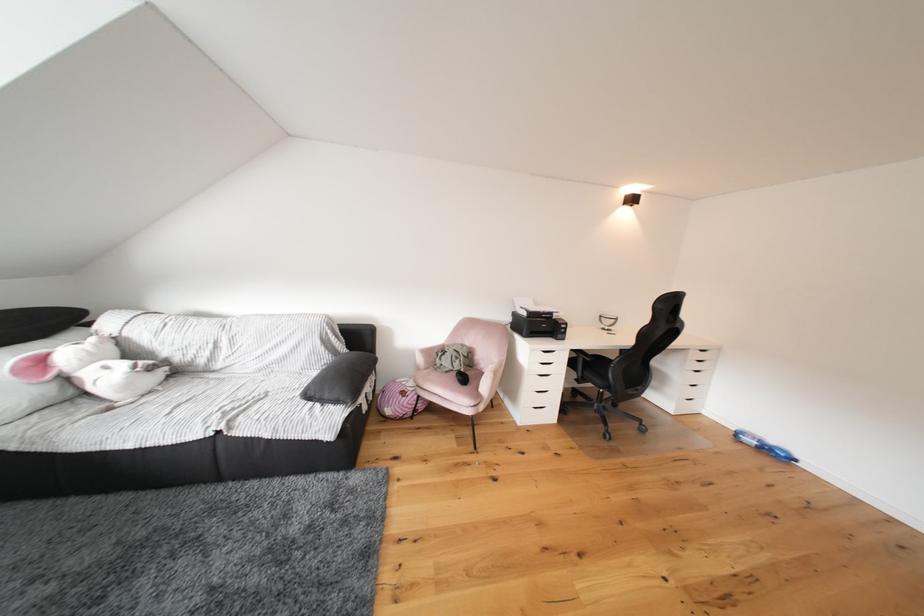
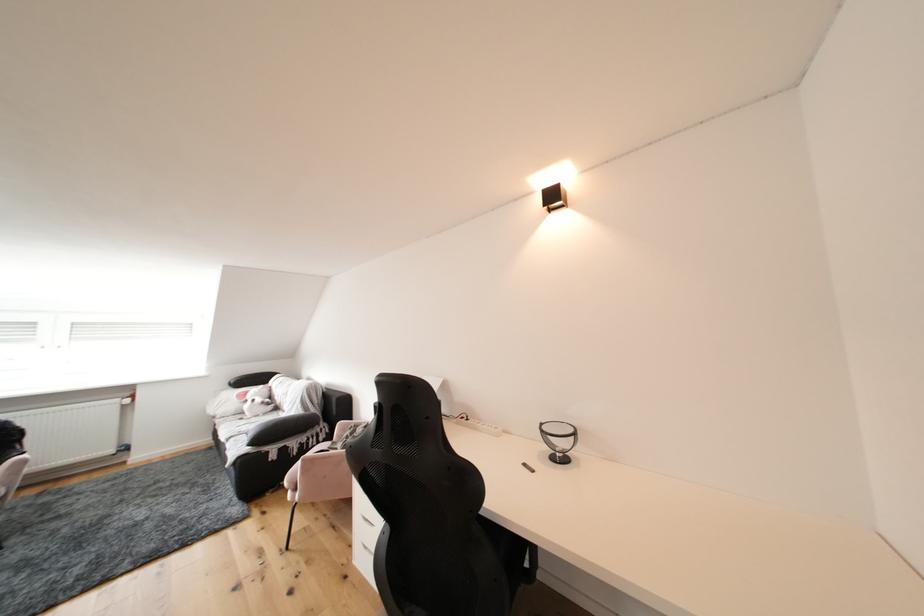
Find the pixel in the second image that matches point (50, 363) in the first image.

(256, 397)